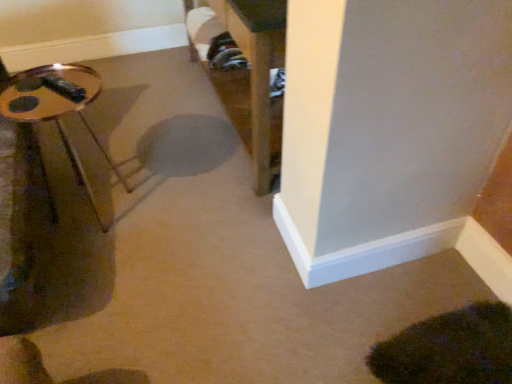
The height and width of the screenshot is (384, 512). I want to click on free space in front of metallic glass table at left, so click(89, 269).